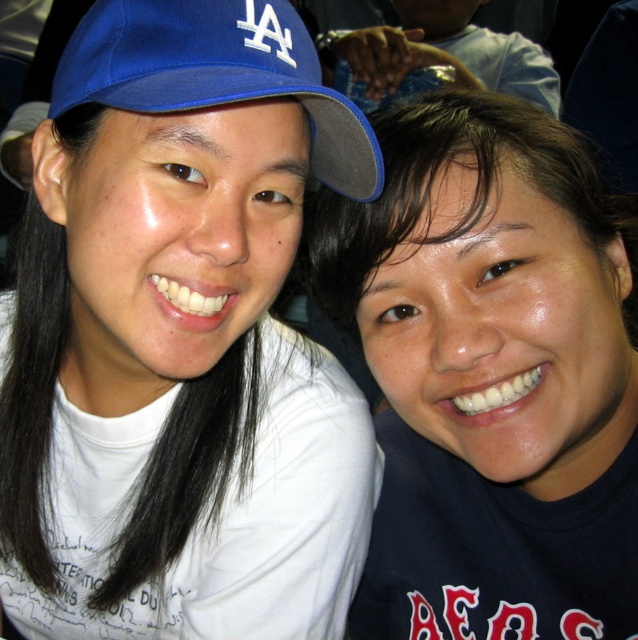
Which is below, matte black shirt at center or blue fabric cap at left?

matte black shirt at center

Who is positioned more to the right, matte black shirt at center or blue fabric cap at left?

matte black shirt at center is more to the right.

Identify the location of matte black shirt at center. This screenshot has width=638, height=640. (491, 376).

Who is shorter, matte white shirt at center or matte black shirt at center?

With less height is matte black shirt at center.

Between point (33, 426) and point (605, 234), which one is positioned in front?

Point (605, 234) is in front.

Locate an element on the screen. matte white shirt at center is located at coordinates (179, 339).

Identify the location of matte white shirt at center. (179, 339).

Locate an element on the screen. The width and height of the screenshot is (638, 640). matte white shirt at center is located at coordinates (179, 339).